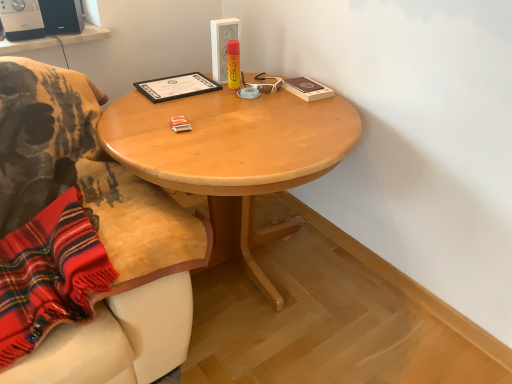
What is the approximate width of black matte certificate at upper center?

It is 11.65 inches.

Describe the element at coordinates (176, 87) in the screenshot. I see `black matte certificate at upper center` at that location.

Measure the distance between light wood table at center and camera.

light wood table at center and camera are 4.07 feet apart from each other.

Locate an element on the screen. black plastic speaker at upper left, which is counted as the second loudspeaker, starting from the right is located at coordinates [21, 19].

The height and width of the screenshot is (384, 512). I want to click on desk that appears in front of the matte black speaker at upper left, the 2th loudspeaker viewed from the left, so click(x=232, y=157).

From the image's perspective, which one is positioned lower, light wood table at center or matte black speaker at upper left, the 1th loudspeaker from the right?

light wood table at center, from the image's perspective.

Would you say black matte certificate at upper center is a long distance from light wood table at center?

black matte certificate at upper center is actually quite close to light wood table at center.

Considering the relative sizes of black matte certificate at upper center and light wood table at center in the image provided, is black matte certificate at upper center smaller than light wood table at center?

Yes.

What's the angular difference between black matte certificate at upper center and light wood table at center's facing directions?

They differ by 4.08 degrees in their facing directions.

Does black plastic speaker at upper left, which is counted as the second loudspeaker, starting from the right, come behind light wood table at center?

Yes, the depth of black plastic speaker at upper left, which is counted as the second loudspeaker, starting from the right, is greater than that of light wood table at center.

Which is closer, (34,0) or (222,113)?

Point (34,0) appears to be farther away from the viewer than point (222,113).

Is light wood table at center completely or partially inside black plastic speaker at upper left, which is counted as the second loudspeaker, starting from the right?

No, light wood table at center is not surrounded by black plastic speaker at upper left, which is counted as the second loudspeaker, starting from the right.

Is matte black speaker at upper left, the 1th loudspeaker from the right, completely or partially outside of light wood table at center?

Indeed, matte black speaker at upper left, the 1th loudspeaker from the right, is completely outside light wood table at center.

Is there a large distance between matte black speaker at upper left, the 1th loudspeaker from the right, and light wood table at center?

That's not correct — matte black speaker at upper left, the 1th loudspeaker from the right, is a little close to light wood table at center.

Is matte black speaker at upper left, the 1th loudspeaker from the right, looking in the opposite direction of light wood table at center?

matte black speaker at upper left, the 1th loudspeaker from the right, does not have its back to light wood table at center.

Does matte black speaker at upper left, the 2th loudspeaker viewed from the left, have a lesser height compared to light wood table at center?

Correct, matte black speaker at upper left, the 2th loudspeaker viewed from the left, is not as tall as light wood table at center.

From a real-world perspective, which object stands above the other?

matte black speaker at upper left, the 2th loudspeaker viewed from the left, is physically above.

Does point (72, 6) lie behind point (181, 83)?

Yes, point (72, 6) is farther from viewer.

Can you tell me how much matte black speaker at upper left, the 2th loudspeaker viewed from the left, and black plastic speaker at upper left, the 1th loudspeaker from the left, differ in facing direction?

18.9 degrees separate the facing orientations of matte black speaker at upper left, the 2th loudspeaker viewed from the left, and black plastic speaker at upper left, the 1th loudspeaker from the left.

Between matte black speaker at upper left, the 1th loudspeaker from the right, and black plastic speaker at upper left, which is counted as the second loudspeaker, starting from the right, which one has larger width?

Wider between the two is black plastic speaker at upper left, which is counted as the second loudspeaker, starting from the right.

Measure the distance between matte black speaker at upper left, the 2th loudspeaker viewed from the left, and black plastic speaker at upper left, which is counted as the second loudspeaker, starting from the right.

matte black speaker at upper left, the 2th loudspeaker viewed from the left, is 3.39 inches away from black plastic speaker at upper left, which is counted as the second loudspeaker, starting from the right.

Which point is more forward, (50, 23) or (2, 21)?

The point (2, 21) is closer.

Would you say black plastic speaker at upper left, the 1th loudspeaker from the left, is to the left or to the right of matte black speaker at upper left, the 1th loudspeaker from the right, in the picture?

From the image, it's evident that black plastic speaker at upper left, the 1th loudspeaker from the left, is to the left of matte black speaker at upper left, the 1th loudspeaker from the right.

Which of these two, black plastic speaker at upper left, the 1th loudspeaker from the left, or matte black speaker at upper left, the 1th loudspeaker from the right, is thinner?

With smaller width is matte black speaker at upper left, the 1th loudspeaker from the right.

What's the angular difference between black plastic speaker at upper left, which is counted as the second loudspeaker, starting from the right, and matte black speaker at upper left, the 1th loudspeaker from the right,'s facing directions?

The angular difference between black plastic speaker at upper left, which is counted as the second loudspeaker, starting from the right, and matte black speaker at upper left, the 1th loudspeaker from the right, is 18.9 degrees.

You are a GUI agent. You are given a task and a screenshot of the screen. Output one action in this format:
    pyautogui.click(x=<x>, y=<y>)
    Task: Click on the loudspeaker below the black plastic speaker at upper left, which is counted as the second loudspeaker, starting from the right (from a real-world perspective)
    This screenshot has height=384, width=512.
    Given the screenshot: What is the action you would take?
    pyautogui.click(x=62, y=16)

From the light wood table at center, count the 1st loudspeaker to the left and point to it. Please provide its 2D coordinates.

[(62, 16)]

What are the coordinates of `desk located below the black matte certificate at upper center (from the image's perspective)` in the screenshot? It's located at (232, 157).

In the scene shown: Estimate the real-world distances between objects in this image. Which object is closer to black plastic speaker at upper left, the 1th loudspeaker from the left, light wood table at center or black matte certificate at upper center?

Based on the image, black matte certificate at upper center appears to be nearer to black plastic speaker at upper left, the 1th loudspeaker from the left.

When comparing their distances from light wood table at center, does black matte certificate at upper center or black plastic speaker at upper left, which is counted as the second loudspeaker, starting from the right, seem closer?

black matte certificate at upper center is positioned closer to the anchor light wood table at center.

Which object lies further to the anchor point black matte certificate at upper center, black plastic speaker at upper left, the 1th loudspeaker from the left, or matte black speaker at upper left, the 2th loudspeaker viewed from the left?

black plastic speaker at upper left, the 1th loudspeaker from the left, is further to black matte certificate at upper center.

Considering their positions, is light wood table at center positioned closer to black matte certificate at upper center than black plastic speaker at upper left, the 1th loudspeaker from the left?

The object closer to black matte certificate at upper center is light wood table at center.

Based on their spatial positions, is matte black speaker at upper left, the 2th loudspeaker viewed from the left, or black plastic speaker at upper left, which is counted as the second loudspeaker, starting from the right, closer to light wood table at center?

matte black speaker at upper left, the 2th loudspeaker viewed from the left, is positioned closer to the anchor light wood table at center.

Considering their positions, is black plastic speaker at upper left, the 1th loudspeaker from the left, positioned further to black matte certificate at upper center than light wood table at center?

black plastic speaker at upper left, the 1th loudspeaker from the left, is further to black matte certificate at upper center.

Based on their spatial positions, is black plastic speaker at upper left, the 1th loudspeaker from the left, or light wood table at center further from matte black speaker at upper left, the 1th loudspeaker from the right?

light wood table at center.

When comparing their distances from matte black speaker at upper left, the 1th loudspeaker from the right, does black plastic speaker at upper left, the 1th loudspeaker from the left, or black matte certificate at upper center seem closer?

Based on the image, black plastic speaker at upper left, the 1th loudspeaker from the left, appears to be nearer to matte black speaker at upper left, the 1th loudspeaker from the right.

At what (x,y) coordinates should I click in order to perform the action: click on loudspeaker located between black plastic speaker at upper left, which is counted as the second loudspeaker, starting from the right, and black matte certificate at upper center in the left-right direction. Please return your answer as a coordinate pair (x, y). Looking at the image, I should click on (62, 16).

Locate an element on the screen. The width and height of the screenshot is (512, 384). book between matte black speaker at upper left, the 2th loudspeaker viewed from the left, and light wood table at center, in the vertical direction is located at coordinates [x=176, y=87].

In order to click on loudspeaker between black plastic speaker at upper left, which is counted as the second loudspeaker, starting from the right, and light wood table at center from left to right in this screenshot , I will do `click(62, 16)`.

Locate an element on the screen. book situated between black plastic speaker at upper left, which is counted as the second loudspeaker, starting from the right, and light wood table at center from left to right is located at coordinates (176, 87).